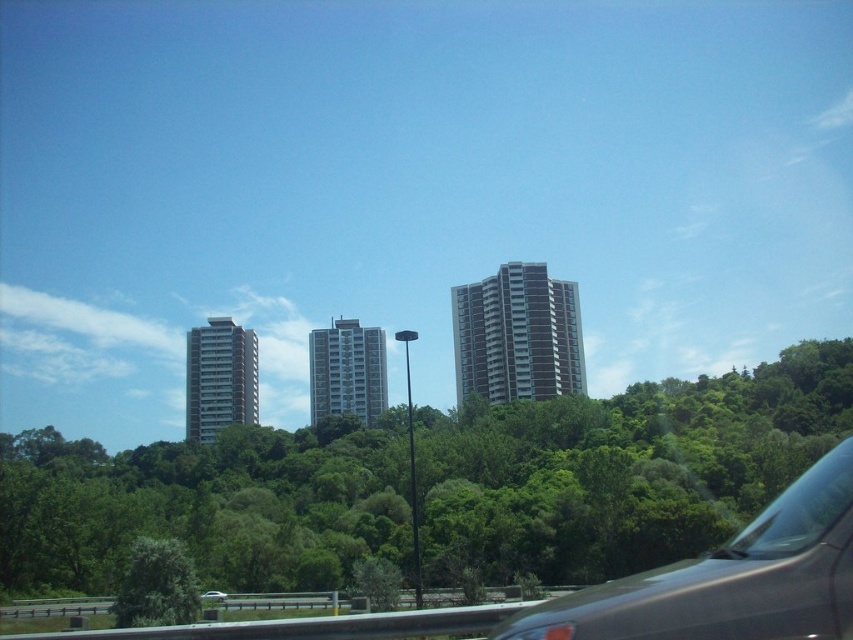
Question: Which point is farther from the camera taking this photo?

Choices:
 (A) (480, 339)
 (B) (340, 602)

Answer: (A)

Question: Which point is closer to the camera taking this photo?

Choices:
 (A) (698, 404)
 (B) (163, 602)
 (C) (221, 596)
 (D) (550, 592)

Answer: (B)

Question: Which of the following is the closest to the observer?

Choices:
 (A) (35, 561)
 (B) (223, 593)

Answer: (A)

Question: Is black matte car at lower right below smooth concrete building at left?

Choices:
 (A) no
 (B) yes

Answer: (A)

Question: Observing the image, what is the correct spatial positioning of smooth gray building at center in reference to green leafy tree at lower left?

Choices:
 (A) below
 (B) above

Answer: (A)

Question: Observing the image, what is the correct spatial positioning of transparent glass car window at lower right in reference to smooth gray building at center?

Choices:
 (A) below
 (B) above

Answer: (B)